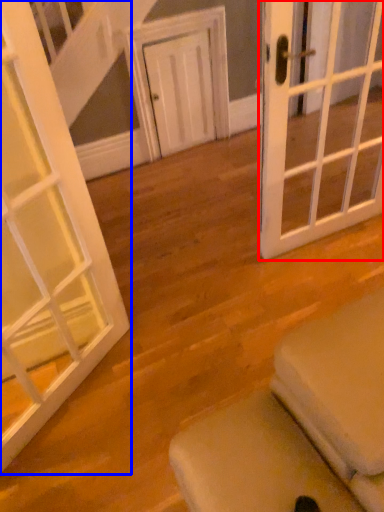
Question: Which object appears farthest to the camera in this image, door (highlighted by a red box) or door (highlighted by a blue box)?

Choices:
 (A) door
 (B) door

Answer: (A)